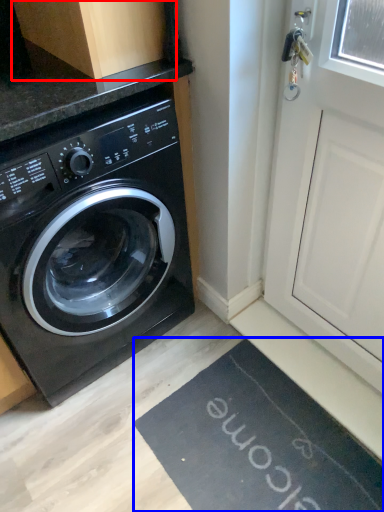
Question: Which object is closer to the camera taking this photo, cabinetry (highlighted by a red box) or bath mat (highlighted by a blue box)?

Choices:
 (A) cabinetry
 (B) bath mat

Answer: (A)